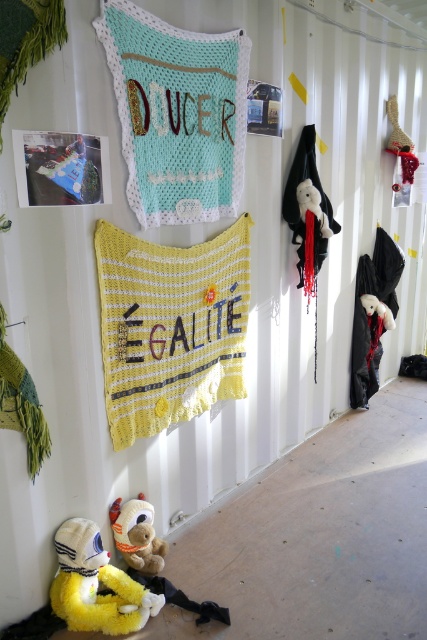
Question: Where is yellow crocheted blanket at center located in relation to black matte bat at right in the image?

Choices:
 (A) below
 (B) above

Answer: (B)

Question: Among these points, which one is nearest to the camera?

Choices:
 (A) (180, 307)
 (B) (157, 128)
 (C) (316, 193)

Answer: (B)

Question: Can you confirm if yellow crocheted blanket at center is wider than white plush bear at center?

Choices:
 (A) no
 (B) yes

Answer: (B)

Question: Which object is the closest to the yellow plush toy at lower left?

Choices:
 (A) crochet fabric pillow at upper center
 (B) brown plush teddy bear at lower left

Answer: (B)

Question: Where is yellow crocheted blanket at center located in relation to white plush bear at center in the image?

Choices:
 (A) above
 (B) below

Answer: (B)

Question: Which of these objects is positioned farthest from the yellow crocheted blanket at center?

Choices:
 (A) yellow plush toy at lower left
 (B) crochet fabric pillow at upper center
 (C) white plush bear at center
 (D) black matte bat at right

Answer: (D)